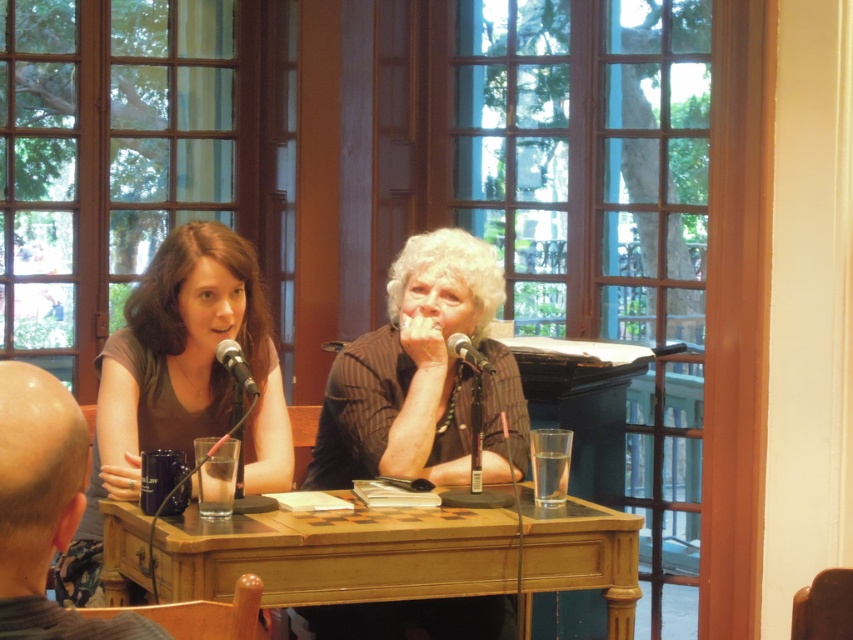
Is wooden table at center positioned before matte black microphone at left?

Yes, it is.

Is the position of wooden table at center more distant than that of matte black microphone at left?

No, it is not.

Find the location of a particular element. wooden table at center is located at coordinates (339, 554).

Does wooden table at center have a lesser width compared to shiny black mug at lower left?

No.

This screenshot has height=640, width=853. Describe the element at coordinates (339, 554) in the screenshot. I see `wooden table at center` at that location.

What do you see at coordinates (339, 554) in the screenshot? I see `wooden table at center` at bounding box center [339, 554].

This screenshot has height=640, width=853. Identify the location of wooden table at center. (339, 554).

Between wooden table at center and metallic silver microphone at center, which one is positioned higher?

metallic silver microphone at center is higher up.

Measure the distance from wooden table at center to metallic silver microphone at center.

wooden table at center is 23.51 inches away from metallic silver microphone at center.

Image resolution: width=853 pixels, height=640 pixels. Identify the location of wooden table at center. (339, 554).